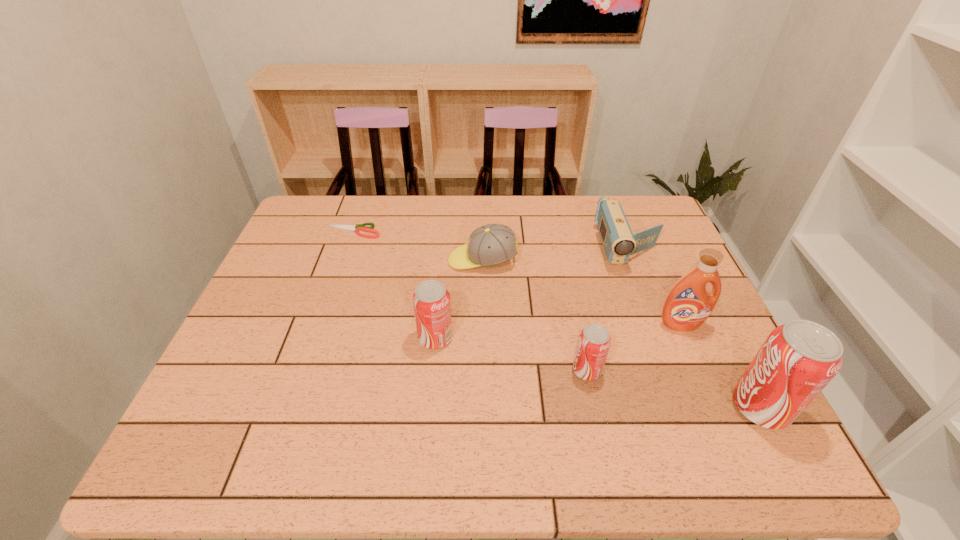
Find the location of a particular element. This screenshot has width=960, height=540. blank space at the near right corner is located at coordinates (687, 408).

The image size is (960, 540). What are the coordinates of `free spot between the leftmost soda can and the second soda can from left to right` in the screenshot? It's located at (511, 354).

Find the location of a particular element. free space between the farthest soda can and the baseball cap is located at coordinates (459, 299).

Where is `empty location between the detergent and the baseball cap`? empty location between the detergent and the baseball cap is located at coordinates (582, 292).

Identify the location of free space between the shortest object and the baseball cap. This screenshot has height=540, width=960. (418, 246).

Image resolution: width=960 pixels, height=540 pixels. What are the coordinates of `vacant region between the baseball cap and the farthest soda can` in the screenshot? It's located at (459, 299).

Where is `empty space that is in between the detergent and the scissors`? empty space that is in between the detergent and the scissors is located at coordinates (516, 278).

Identify the location of empty location between the farthest soda can and the baseball cap. (459, 299).

Locate an element on the screen. This screenshot has width=960, height=540. object identified as the fifth closest to the third tallest object is located at coordinates (688, 304).

Locate an element on the screen. object that is the nearest to the shortest soda can is located at coordinates (688, 304).